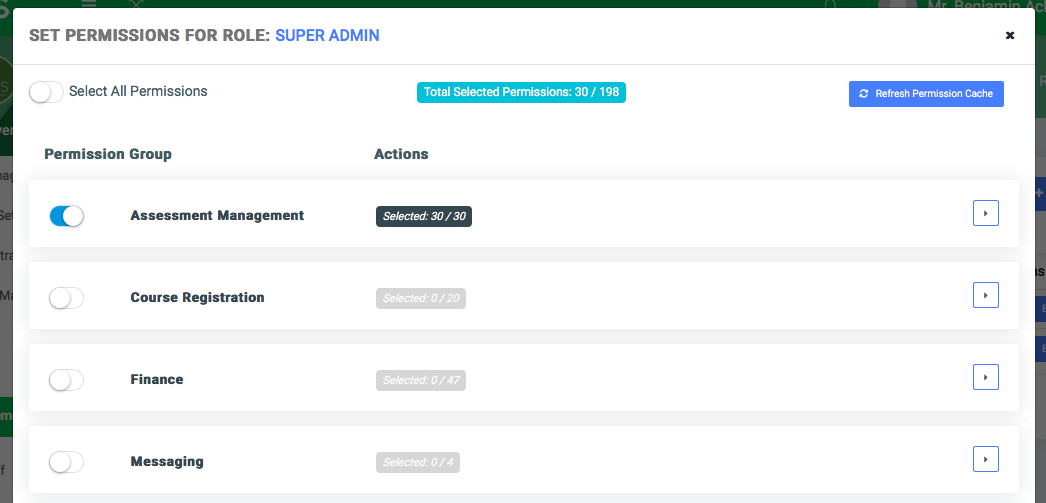
Where is `exit button`? exit button is located at coordinates (1004, 36).